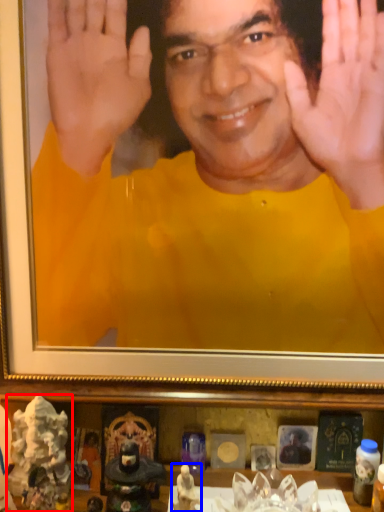
Question: Among these objects, which one is nearest to the camera, toy (highlighted by a red box) or toy (highlighted by a blue box)?

Choices:
 (A) toy
 (B) toy

Answer: (B)